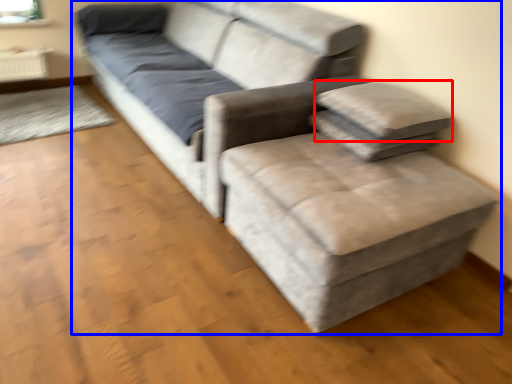
Question: Which object is closer to the camera taking this photo, pillow (highlighted by a red box) or studio couch (highlighted by a blue box)?

Choices:
 (A) pillow
 (B) studio couch

Answer: (B)